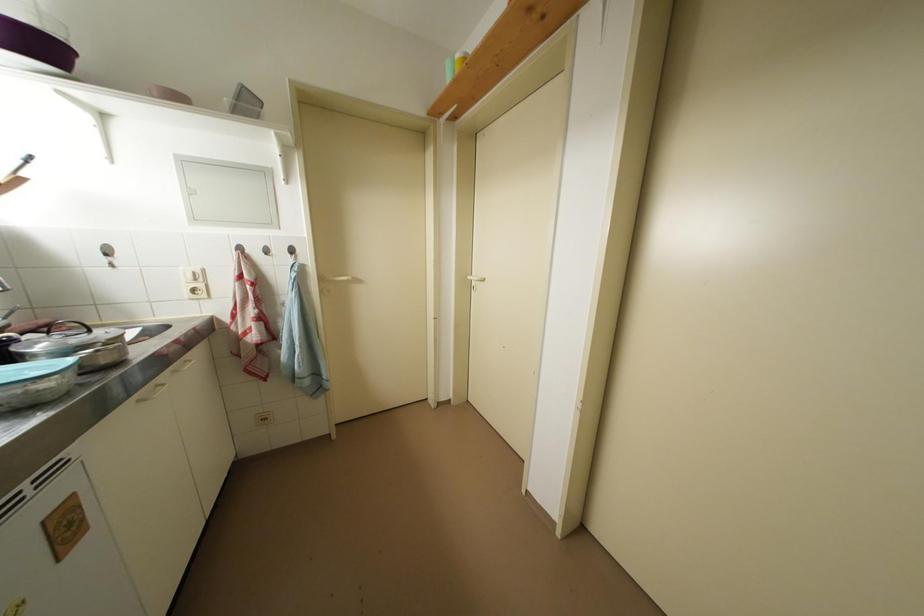
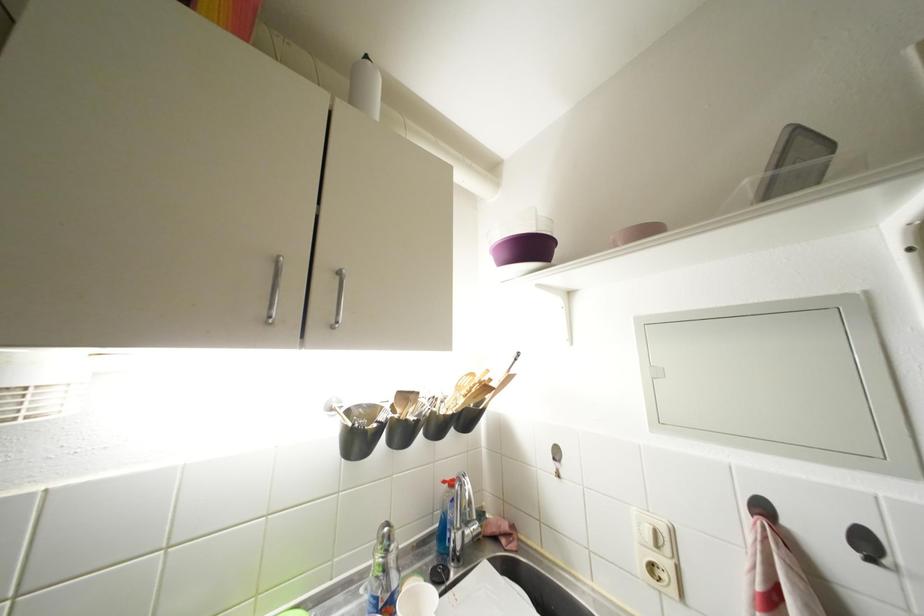
Where in the second image is the point corresponding to [202,283] from the first image?

(663, 549)